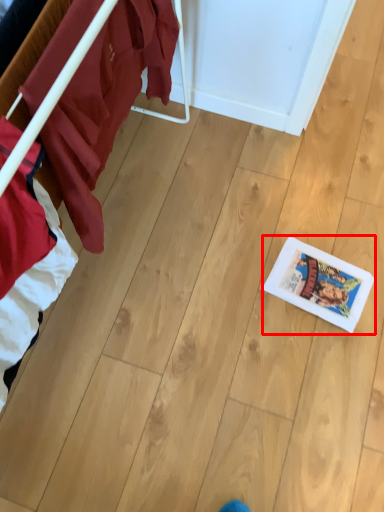
Question: Considering the relative positions of comic book (annotated by the red box) and furniture in the image provided, where is comic book (annotated by the red box) located with respect to the staircase?

Choices:
 (A) right
 (B) left

Answer: (A)